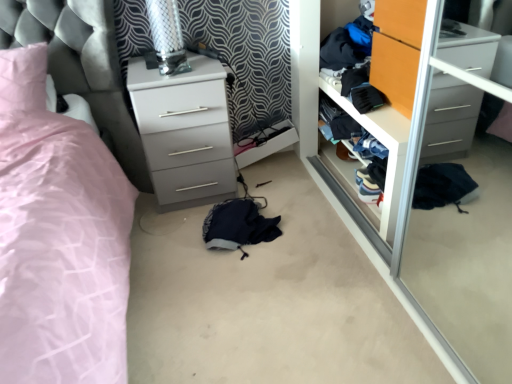
Question: From a real-world perspective, is white glossy chest of drawers at center above or below wooden closet door at center?

Choices:
 (A) below
 (B) above

Answer: (B)

Question: Is point (166, 180) closer or farther from the camera than point (371, 218)?

Choices:
 (A) closer
 (B) farther

Answer: (B)

Question: Estimate the real-world distances between objects in this image. Which object is farther from the wooden closet door at center?

Choices:
 (A) navy blue fabric at center
 (B) white glossy chest of drawers at center
 (C) orange wood wardrobe at center

Answer: (B)

Question: Estimate the real-world distances between objects in this image. Which object is farther from the wooden closet door at center?

Choices:
 (A) navy blue fabric at center
 (B) orange wood wardrobe at center
 (C) white glossy chest of drawers at center

Answer: (C)